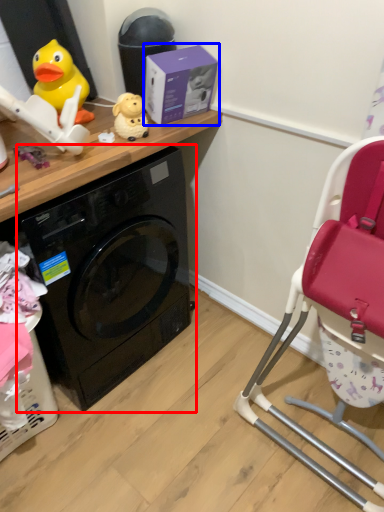
Question: Which object is closer to the camera taking this photo, washing machine (highlighted by a red box) or box (highlighted by a blue box)?

Choices:
 (A) washing machine
 (B) box

Answer: (A)